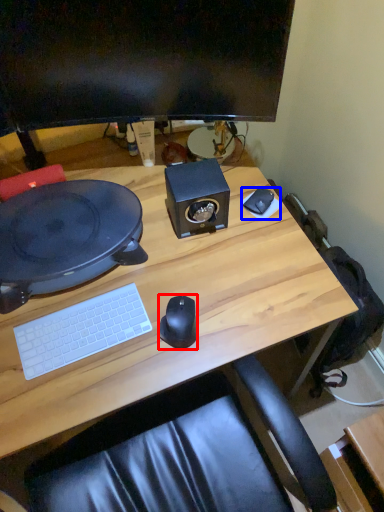
Question: Which of the following is the farthest to the observer, mouse (highlighted by a red box) or mousepad (highlighted by a blue box)?

Choices:
 (A) mouse
 (B) mousepad

Answer: (B)